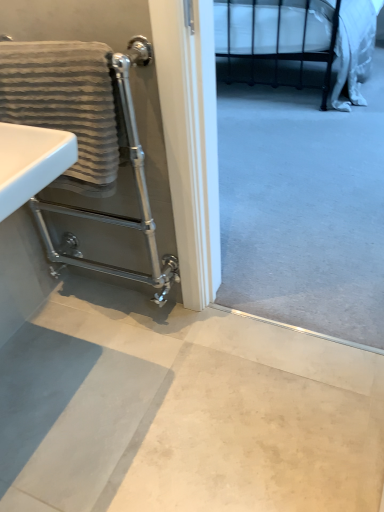
Question: Should I look upward or downward to see silver metallic towel rack at left?

Choices:
 (A) down
 (B) up

Answer: (B)

Question: Is silver metallic towel rack at left bigger than smooth concrete floor at lower center?

Choices:
 (A) yes
 (B) no

Answer: (A)

Question: From a real-world perspective, does silver metallic towel rack at left sit lower than smooth concrete floor at lower center?

Choices:
 (A) no
 (B) yes

Answer: (A)

Question: Can you confirm if silver metallic towel rack at left is positioned to the left of smooth concrete floor at lower center?

Choices:
 (A) no
 (B) yes

Answer: (B)

Question: Is smooth concrete floor at lower center located within silver metallic towel rack at left?

Choices:
 (A) yes
 (B) no

Answer: (B)

Question: Is silver metallic towel rack at left far away from smooth concrete floor at lower center?

Choices:
 (A) no
 (B) yes

Answer: (A)

Question: From the image's perspective, is silver metallic towel rack at left located above smooth concrete floor at lower center?

Choices:
 (A) yes
 (B) no

Answer: (A)

Question: Is gray textured towel at left in contact with smooth concrete floor at lower center?

Choices:
 (A) yes
 (B) no

Answer: (B)

Question: From a real-world perspective, is gray textured towel at left under smooth concrete floor at lower center?

Choices:
 (A) no
 (B) yes

Answer: (A)

Question: Is gray textured towel at left positioned before smooth concrete floor at lower center?

Choices:
 (A) no
 (B) yes

Answer: (A)

Question: From the image's perspective, is gray textured towel at left on top of smooth concrete floor at lower center?

Choices:
 (A) no
 (B) yes

Answer: (B)

Question: Would you say smooth concrete floor at lower center is part of gray textured towel at left's contents?

Choices:
 (A) no
 (B) yes

Answer: (A)

Question: Can you confirm if gray textured towel at left is bigger than smooth concrete floor at lower center?

Choices:
 (A) no
 (B) yes

Answer: (A)

Question: From the image's perspective, would you say smooth concrete floor at lower center is shown under silver metallic towel rack at left?

Choices:
 (A) no
 (B) yes

Answer: (B)